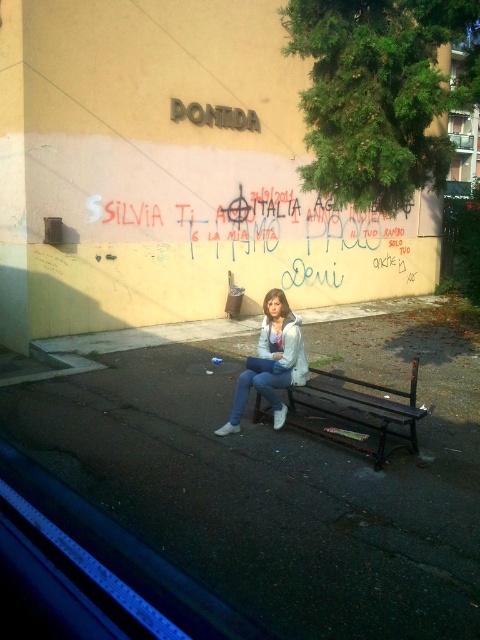
Question: Which object is the farthest from the red graffiti at center?

Choices:
 (A) dark brown wooden bench at center
 (B) white matte jacket at center

Answer: (A)

Question: Which of the following is the farthest from the observer?

Choices:
 (A) white matte jacket at center
 (B) dark brown wooden bench at center
 (C) red graffiti at center

Answer: (C)

Question: Does red graffiti at center have a greater width compared to white matte jacket at center?

Choices:
 (A) yes
 (B) no

Answer: (B)

Question: Which point is farther from the camera taking this photo?

Choices:
 (A) (300, 387)
 (B) (296, 204)

Answer: (B)

Question: Is dark brown wooden bench at center smaller than white matte jacket at center?

Choices:
 (A) yes
 (B) no

Answer: (B)

Question: Is the position of dark brown wooden bench at center more distant than that of white matte jacket at center?

Choices:
 (A) yes
 (B) no

Answer: (B)